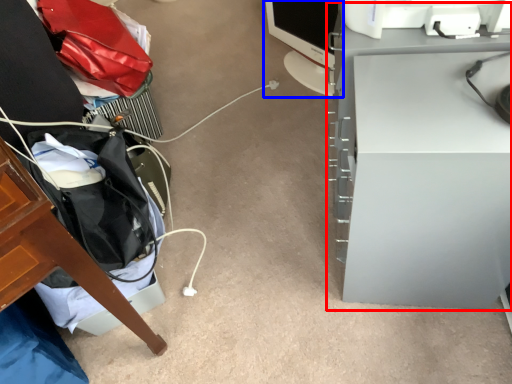
Question: Among these objects, which one is nearest to the camera, computer desk (highlighted by a red box) or computer monitor (highlighted by a blue box)?

Choices:
 (A) computer desk
 (B) computer monitor

Answer: (A)